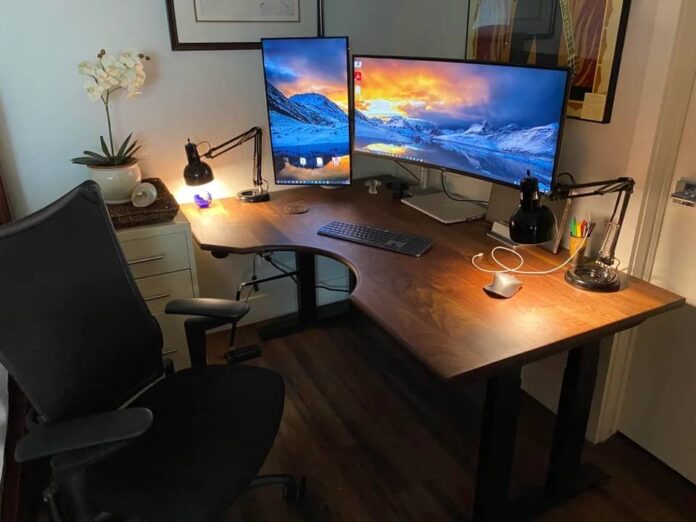
Find the location of a particular element. This screenshot has width=696, height=522. keyboard is located at coordinates (363, 236).